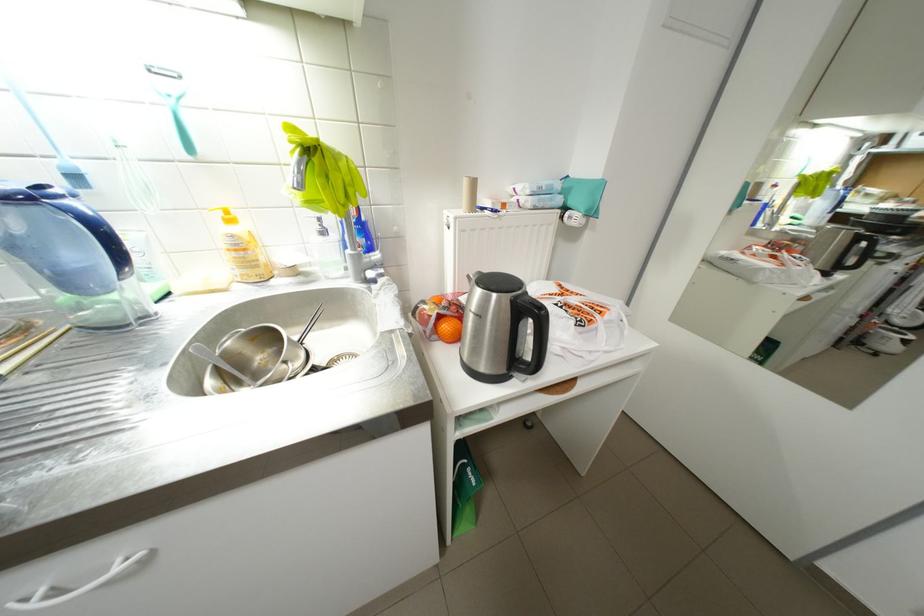
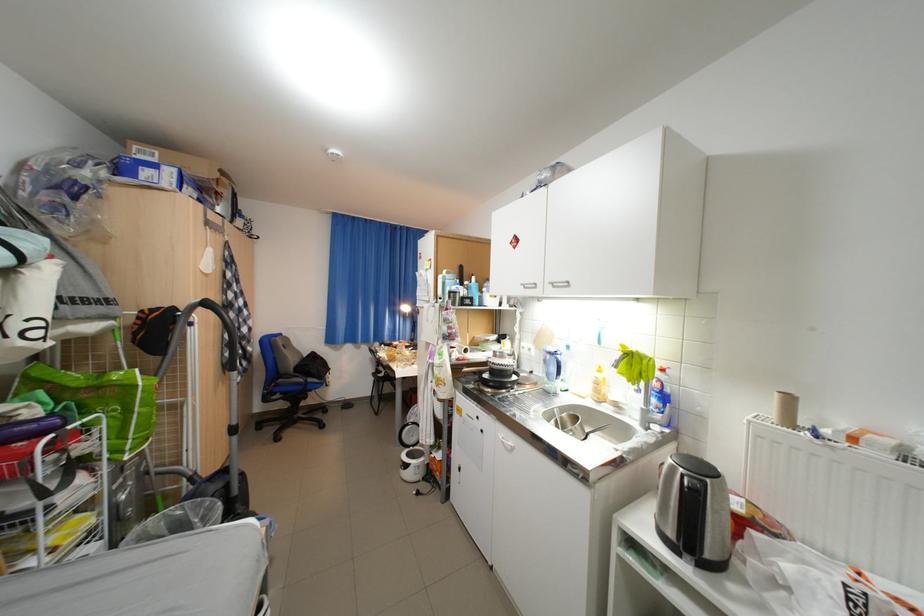
Locate, in the second image, the point that corresponds to [237,292] in the first image.

(594, 399)